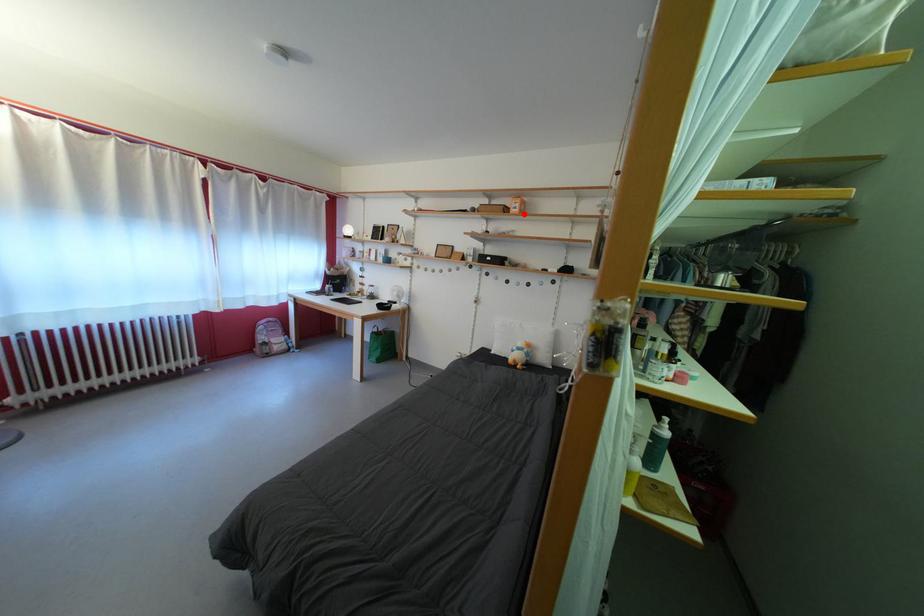
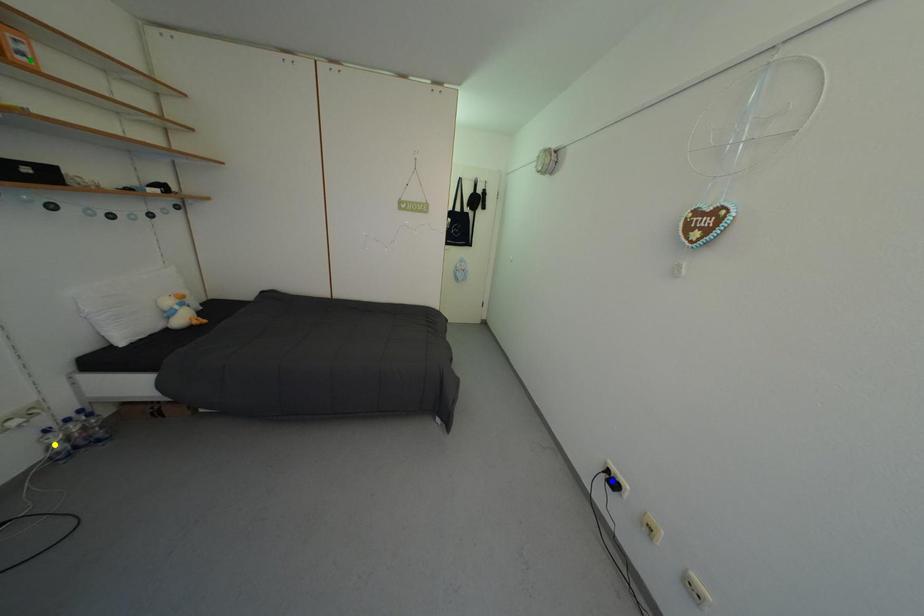
Question: I am providing you with two images of the same scene from different viewpoints. A red point is marked on the first image. You are given multiple points on the second image. Which point in image 2 represents the same 3d spot as the red point in image 1?

Choices:
 (A) yellow point
 (B) blue point
 (C) green point

Answer: (C)